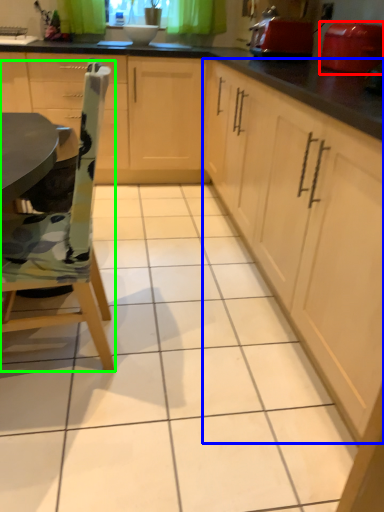
Question: Which is nearer to the appliance (highlighted by a red box)? cabinetry (highlighted by a blue box) or chair (highlighted by a green box).

Choices:
 (A) cabinetry
 (B) chair

Answer: (A)